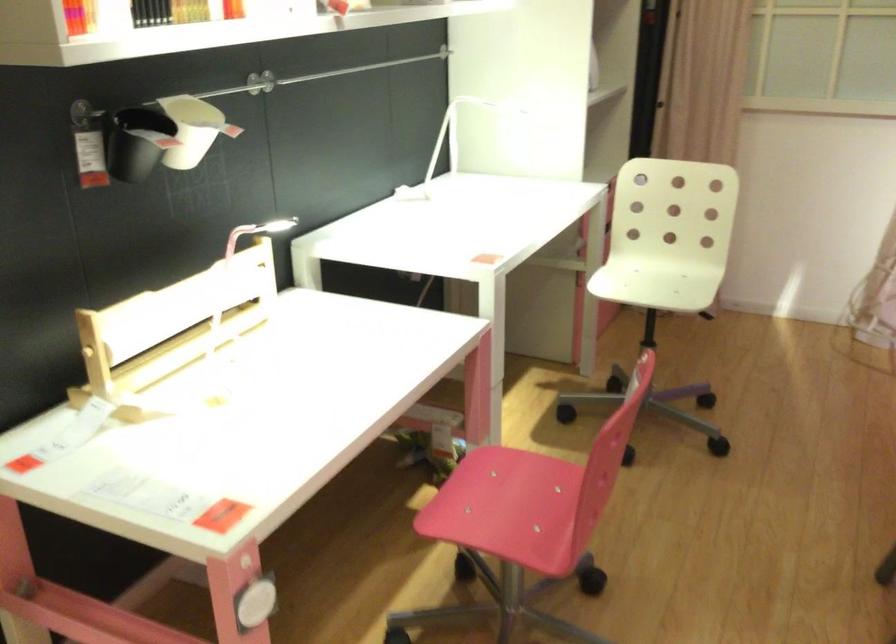
The image size is (896, 644). What do you see at coordinates (511, 482) in the screenshot? I see `the pink chair sitting surface` at bounding box center [511, 482].